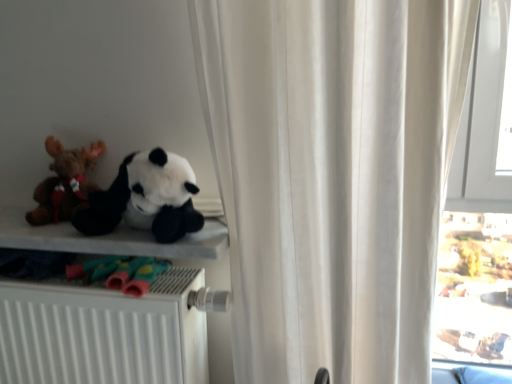
Question: Is soft plush panda at left, which is the first toy from right to left, to the right of white matte radiator at lower left from the viewer's perspective?

Choices:
 (A) yes
 (B) no

Answer: (A)

Question: Can you confirm if soft plush panda at left, the second toy viewed from the left, is shorter than white matte radiator at lower left?

Choices:
 (A) yes
 (B) no

Answer: (A)

Question: Does soft plush panda at left, the second toy viewed from the left, turn towards white matte radiator at lower left?

Choices:
 (A) yes
 (B) no

Answer: (B)

Question: From a real-world perspective, is soft plush panda at left, the second toy viewed from the left, on white matte radiator at lower left?

Choices:
 (A) no
 (B) yes

Answer: (B)

Question: Does soft plush panda at left, which is the first toy from right to left, lie in front of white matte radiator at lower left?

Choices:
 (A) no
 (B) yes

Answer: (B)

Question: From a real-world perspective, is brown plush toy at left, the second toy when ordered from right to left, above or below white matte radiator at lower left?

Choices:
 (A) below
 (B) above

Answer: (B)

Question: From the image's perspective, is brown plush toy at left, the second toy when ordered from right to left, located above or below white matte radiator at lower left?

Choices:
 (A) below
 (B) above

Answer: (B)

Question: Considering the positions of point (45, 145) and point (203, 271), is point (45, 145) closer or farther from the camera than point (203, 271)?

Choices:
 (A) farther
 (B) closer

Answer: (A)

Question: Considering the relative positions of brown plush toy at left, which appears as the first toy when viewed from the left, and white matte radiator at lower left in the image provided, is brown plush toy at left, which appears as the first toy when viewed from the left, to the left or to the right of white matte radiator at lower left?

Choices:
 (A) right
 (B) left

Answer: (B)

Question: Is white fabric curtain at upper center taller or shorter than transparent glass window at right?

Choices:
 (A) tall
 (B) short

Answer: (B)

Question: Considering the positions of white fabric curtain at upper center and transparent glass window at right in the image, is white fabric curtain at upper center bigger or smaller than transparent glass window at right?

Choices:
 (A) small
 (B) big

Answer: (B)

Question: Is white fabric curtain at upper center wider or thinner than transparent glass window at right?

Choices:
 (A) thin
 (B) wide

Answer: (B)

Question: Considering the positions of point (390, 329) and point (492, 107), is point (390, 329) closer or farther from the camera than point (492, 107)?

Choices:
 (A) closer
 (B) farther

Answer: (A)

Question: Is point (409, 213) positioned closer to the camera than point (42, 350)?

Choices:
 (A) closer
 (B) farther

Answer: (A)

Question: Is white fabric curtain at upper center wider or thinner than white matte radiator at lower left?

Choices:
 (A) wide
 (B) thin

Answer: (A)